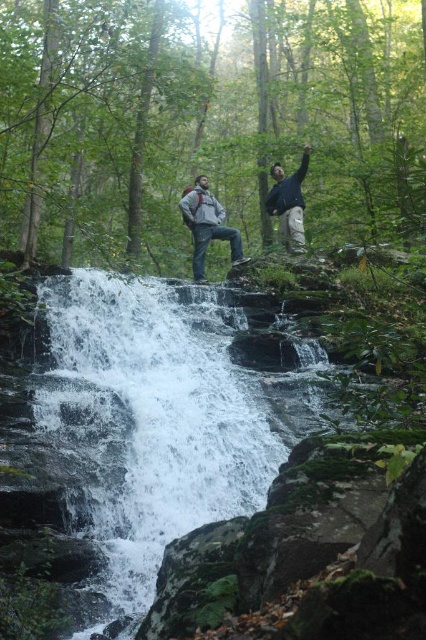
Question: Which of the following is the farthest from the observer?

Choices:
 (A) (417, 160)
 (B) (207, 180)

Answer: (B)

Question: Which of these objects is positioned farthest from the dark blue jacket at upper center?

Choices:
 (A) gray matte jacket at center
 (B) white frothy water at center

Answer: (B)

Question: Can you confirm if white frothy water at center is positioned to the left of matte gray jacket at center?

Choices:
 (A) no
 (B) yes

Answer: (B)

Question: Does matte gray jacket at center have a lesser width compared to dark blue jacket at upper center?

Choices:
 (A) yes
 (B) no

Answer: (B)

Question: Among these objects, which one is nearest to the camera?

Choices:
 (A) dark blue jacket at upper center
 (B) gray matte jacket at center
 (C) matte gray jacket at center

Answer: (A)

Question: Is white frothy water at center to the left of matte gray jacket at center from the viewer's perspective?

Choices:
 (A) yes
 (B) no

Answer: (A)